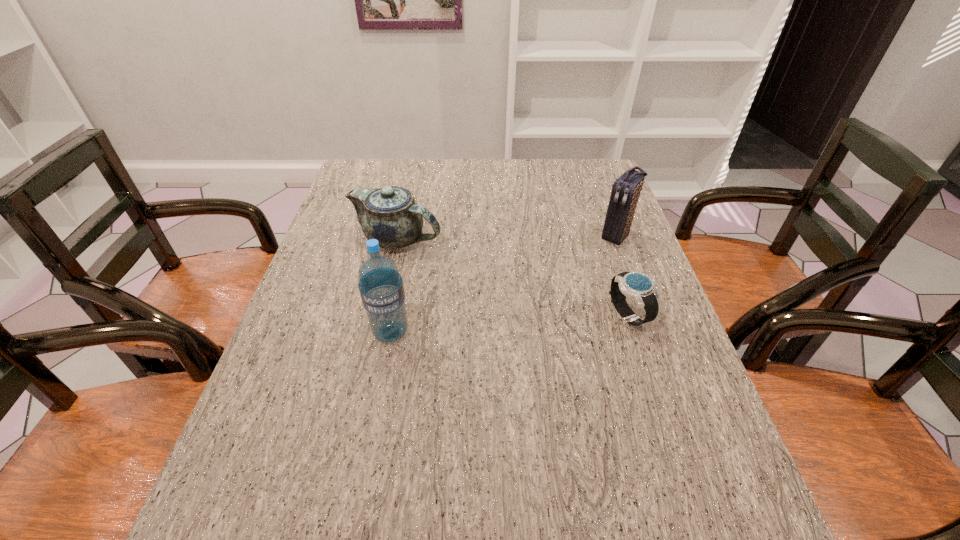
The image size is (960, 540). In order to click on free spot located 0.090m from the spout of the second shortest object in this screenshot , I will do `click(453, 265)`.

Where is `free space located from the spout of the second shortest object`? free space located from the spout of the second shortest object is located at coordinates (459, 268).

Find the location of a particular element. object that is at the left edge is located at coordinates (390, 215).

Find the location of a particular element. watch situated at the right edge is located at coordinates (638, 286).

This screenshot has width=960, height=540. What are the coordinates of `clutch bag at the right edge` in the screenshot? It's located at (626, 189).

You are a GUI agent. You are given a task and a screenshot of the screen. Output one action in this format:
    pyautogui.click(x=<x>, y=<y>)
    Task: Click on the vacant space at the far edge
    This screenshot has height=540, width=960.
    Given the screenshot: What is the action you would take?
    pyautogui.click(x=530, y=172)

The image size is (960, 540). What are the coordinates of `free location at the near edge of the desktop` in the screenshot? It's located at (587, 442).

At what (x,y) coordinates should I click in order to perform the action: click on free space at the left edge. Please return your answer as a coordinate pair (x, y). Looking at the image, I should click on (302, 345).

This screenshot has width=960, height=540. In the image, there is a desktop. Find the location of `vacant space at the right edge`. vacant space at the right edge is located at coordinates (619, 332).

In the image, there is a desktop. In order to click on free region at the far right corner in this screenshot , I will do (578, 183).